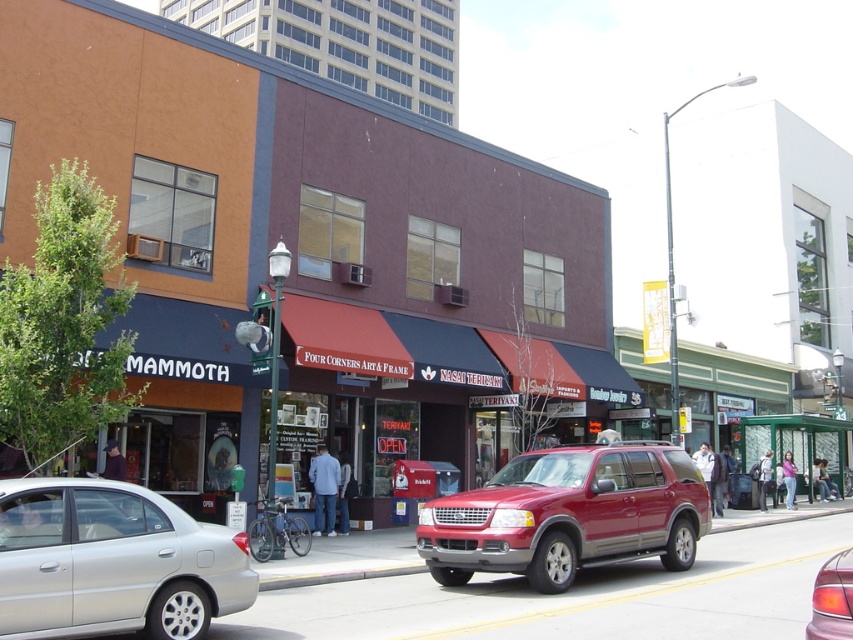
Which is behind, point (117, 483) or point (700, 531)?

Positioned behind is point (700, 531).

This screenshot has height=640, width=853. Describe the element at coordinates (112, 561) in the screenshot. I see `silver metallic sedan at lower left` at that location.

What are the coordinates of `silver metallic sedan at lower left` in the screenshot? It's located at (112, 561).

In order to click on silver metallic sedan at lower left in this screenshot , I will do `click(112, 561)`.

Is the position of shiny red suv at center less distant than that of metallic red suv at center?

No, it is not.

Is point (444, 584) closer to camera compared to point (827, 609)?

No, (444, 584) is behind (827, 609).

At what (x,y) coordinates should I click in order to perform the action: click on shiny red suv at center. Please return your answer as a coordinate pair (x, y). The image size is (853, 640). Looking at the image, I should click on (567, 515).

Find the location of a particular element. silver metallic sedan at lower left is located at coordinates (112, 561).

This screenshot has height=640, width=853. What do you see at coordinates (112, 561) in the screenshot?
I see `silver metallic sedan at lower left` at bounding box center [112, 561].

The height and width of the screenshot is (640, 853). In order to click on silver metallic sedan at lower left in this screenshot , I will do `click(112, 561)`.